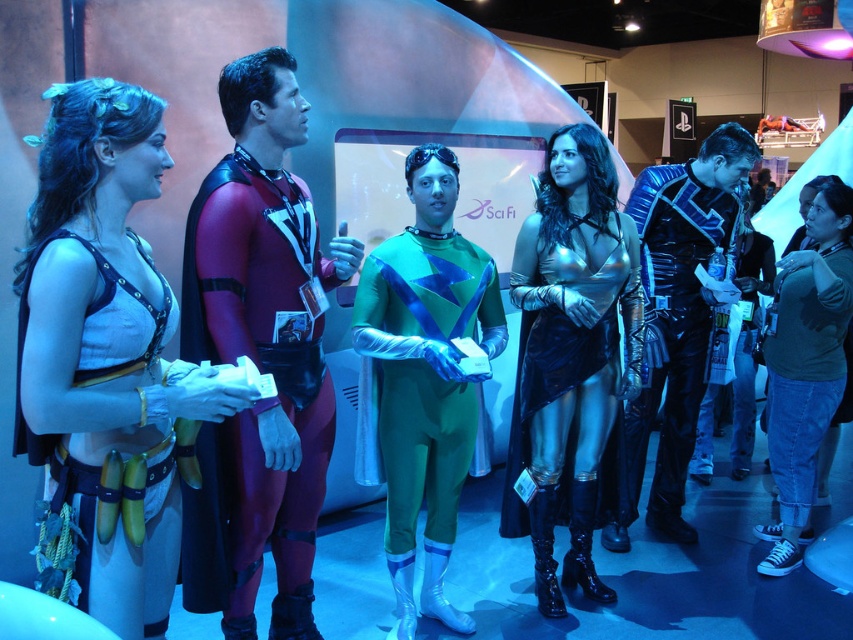
You are standing in the convention hall and see the maroon spandex suit at center. If you want to locate it precisely, what are its coordinates?

The maroon spandex suit at center is located at coordinates point [260,371].

You are at the convention and want to take a photo with the matte white costume at center. According to the coordinates provided, where exactly should you position yourself to capture the costume in the frame?

The matte white costume at center is located at coordinates point (x=100, y=291). To capture it in your photo, position yourself directly in front of this coordinate point.

You are organizing a costume contest and need to ensure all participants can fit through a 1.5 meter wide doorway. You notice the green metallic suit at center and the green cotton shirt at lower right. Based on their sizes, which participant might have difficulty passing through the doorway?

The green metallic suit at center is bigger than the green cotton shirt at lower right, so the participant wearing the green metallic suit at center might have difficulty passing through the 1.5 meter wide doorway due to its larger size.